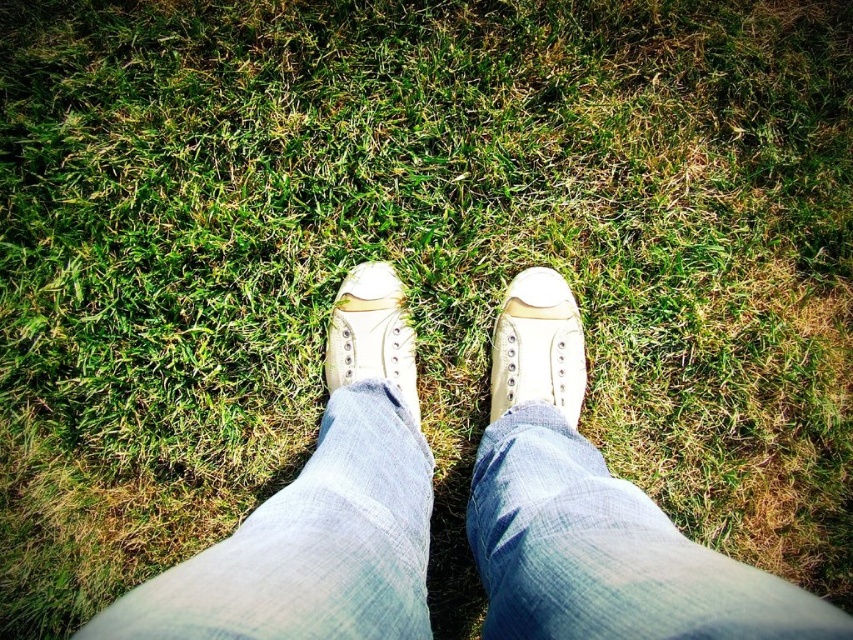
You are a delivery robot that needs to move a package from the white canvas shoe at center to the denim at center. The robot requires a 14 inch path to move. Can you move the package?

The denim at center is 13.89 inches from white canvas shoe at center, so the robot cannot move the package because the required path is 14 inches and the distance is slightly shorter.

You are a photographer trying to capture the exact position where the denim is located at point [607,552]. You need to place a marker at that point. Based on the scene description, where should you place the marker relative to the sneakers?

The denim at center is located at point [607,552], so the marker should be placed at the center position relative to the sneakers.